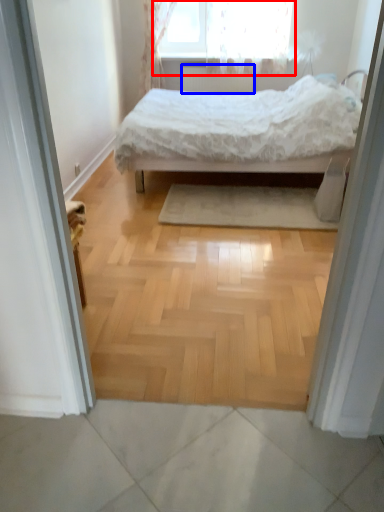
Question: Which object is further to the camera taking this photo, window (highlighted by a red box) or radiator (highlighted by a blue box)?

Choices:
 (A) window
 (B) radiator

Answer: (B)